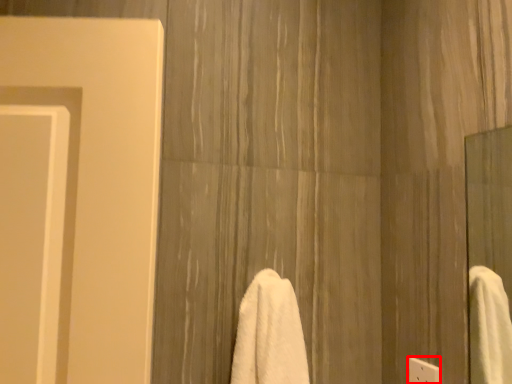
Question: From the image's perspective, where is electric outlet (annotated by the red box) located in relation to towel in the image?

Choices:
 (A) above
 (B) below

Answer: (B)